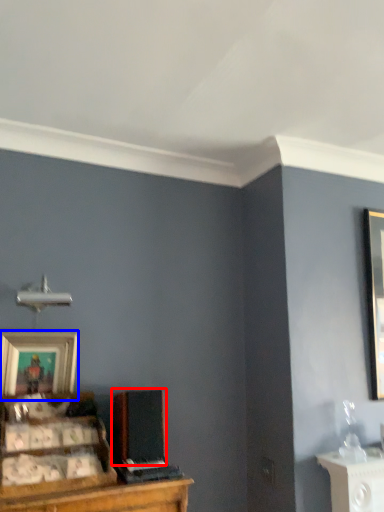
Question: Which object is closer to the camera taking this photo, speaker (highlighted by a red box) or picture frame (highlighted by a blue box)?

Choices:
 (A) speaker
 (B) picture frame

Answer: (A)